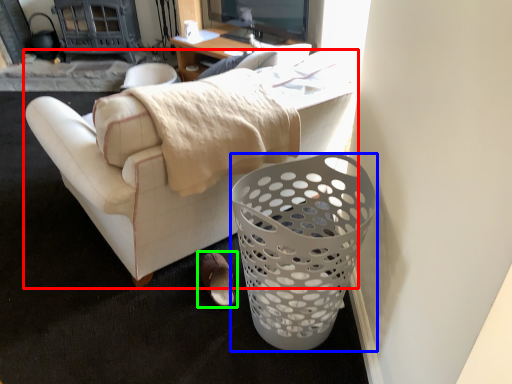
Question: Which object is positioned farthest from studio couch (highlighted by a red box)? Select from trash bin/can (highlighted by a blue box) and footwear (highlighted by a green box).

Choices:
 (A) trash bin/can
 (B) footwear

Answer: (B)